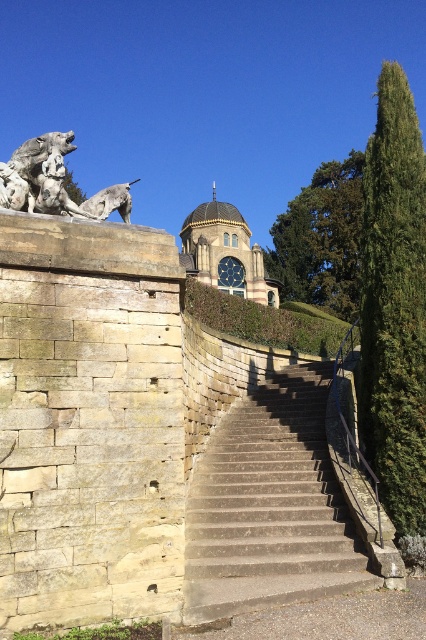
Measure the distance between green textured hedge at right and gold metallic clock at center.

29.44 meters

The width and height of the screenshot is (426, 640). What do you see at coordinates (394, 305) in the screenshot?
I see `green textured hedge at right` at bounding box center [394, 305].

Does point (414, 509) lie behind point (221, 266)?

No, (414, 509) is in front of (221, 266).

The height and width of the screenshot is (640, 426). Find the location of `green textured hedge at right`. green textured hedge at right is located at coordinates (394, 305).

Is green textured hedge at right thinner than green leafy hedge at upper center?

Yes.

Locate an element on the screen. green textured hedge at right is located at coordinates (394, 305).

Is concrete stairs at center bigger than gold textured dome at center?

Actually, concrete stairs at center might be smaller than gold textured dome at center.

Is concrete stairs at center further to camera compared to gold textured dome at center?

That is False.

Locate an element on the screen. The image size is (426, 640). concrete stairs at center is located at coordinates (270, 506).

Find the location of a particular element. The height and width of the screenshot is (640, 426). concrete stairs at center is located at coordinates (270, 506).